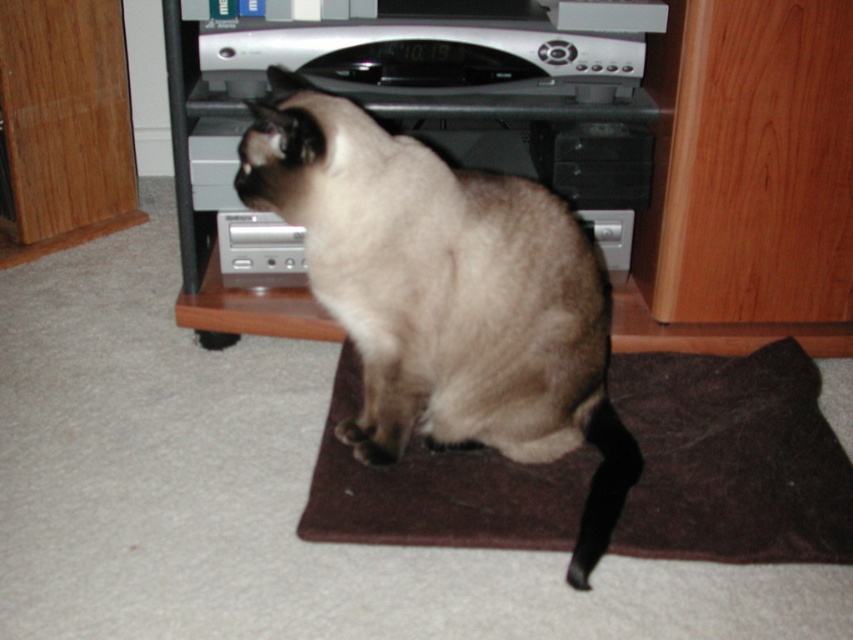
Question: Which point appears farthest from the camera in this image?

Choices:
 (A) (688, 452)
 (B) (207, 296)
 (C) (506, 452)

Answer: (B)

Question: Can you confirm if smokey fur cat at center is positioned to the left of silver metallic entertainment center at center?

Choices:
 (A) yes
 (B) no

Answer: (A)

Question: Among these objects, which one is nearest to the camera?

Choices:
 (A) smokey fur cat at center
 (B) brown felt mat at center
 (C) silver metallic entertainment center at center

Answer: (A)

Question: Considering the real-world distances, which object is closest to the brown felt mat at center?

Choices:
 (A) silver metallic entertainment center at center
 (B) smokey fur cat at center

Answer: (B)

Question: Is smokey fur cat at center to the right of brown felt mat at center from the viewer's perspective?

Choices:
 (A) yes
 (B) no

Answer: (B)

Question: Can you confirm if brown felt mat at center is thinner than silver metallic entertainment center at center?

Choices:
 (A) no
 (B) yes

Answer: (A)